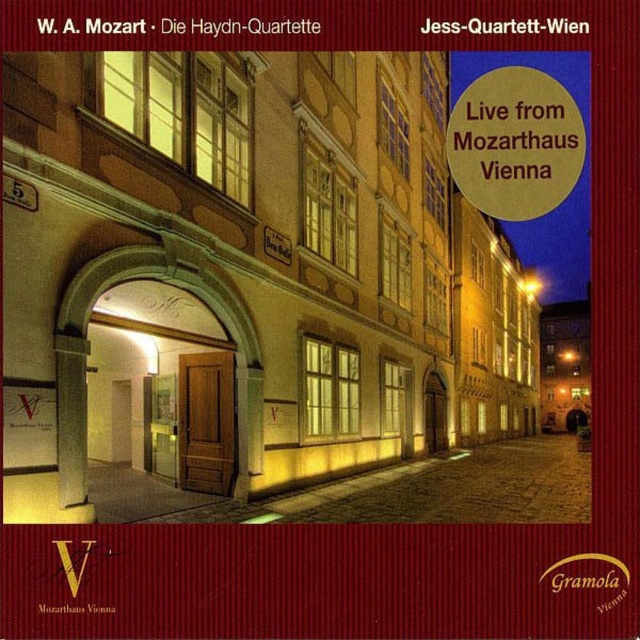
Question: Which object appears closest to the camera in this image?

Choices:
 (A) beige stone building at center
 (B) gold metallic circle at upper right

Answer: (A)

Question: Which point is closer to the camera taking this photo?

Choices:
 (A) (371, 412)
 (B) (477, 177)

Answer: (B)

Question: Where is beige stone building at center located in relation to gold metallic circle at upper right in the image?

Choices:
 (A) above
 (B) below

Answer: (B)

Question: Can you confirm if beige stone building at center is positioned above gold metallic circle at upper right?

Choices:
 (A) no
 (B) yes

Answer: (A)

Question: Can you confirm if beige stone building at center is positioned to the left of gold metallic circle at upper right?

Choices:
 (A) yes
 (B) no

Answer: (A)